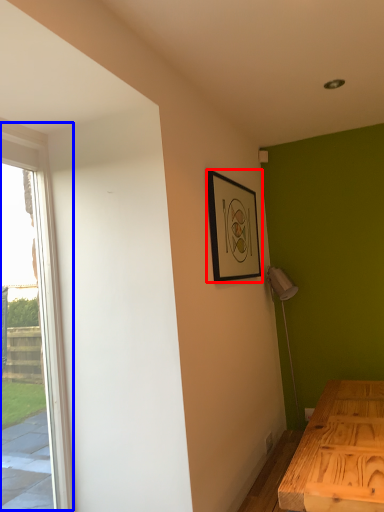
Question: Which object appears farthest to the camera in this image, picture frame (highlighted by a red box) or window (highlighted by a blue box)?

Choices:
 (A) picture frame
 (B) window

Answer: (A)